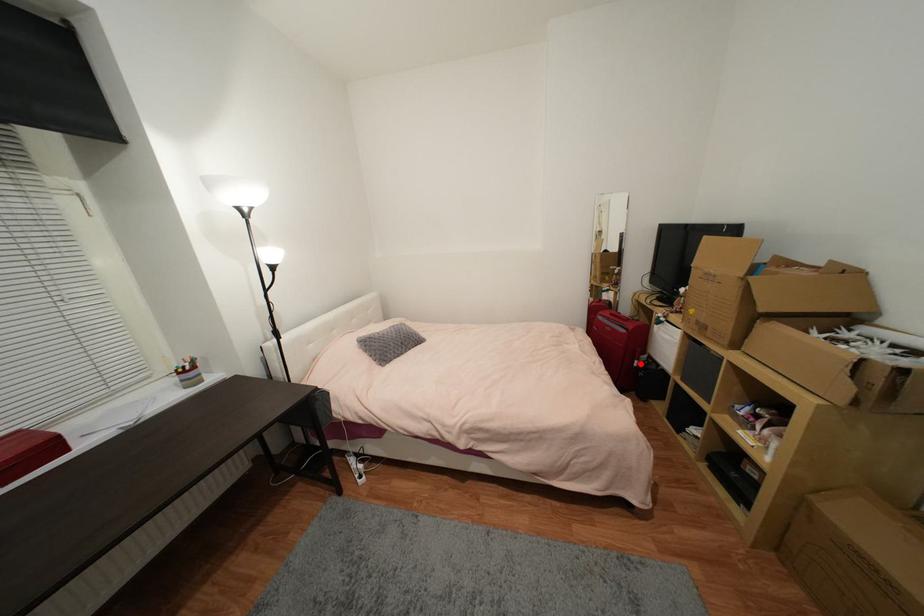
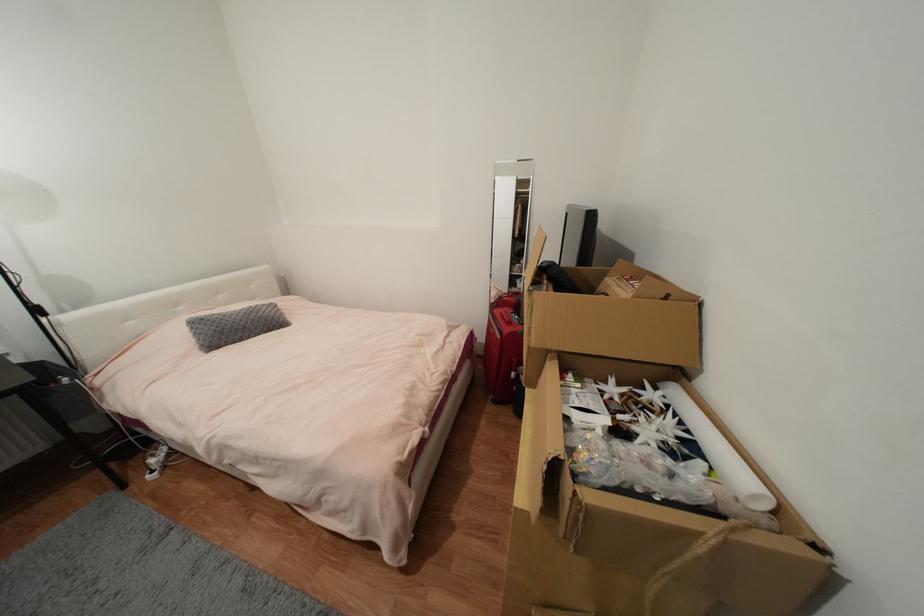
Question: I am providing you with two images of the same scene from different viewpoints. Image1 has a red point marked. In image2, the corresponding 3D location appears at what relative position? Reply with the corresponding letter.

Choices:
 (A) Closer
 (B) Farther

Answer: (A)